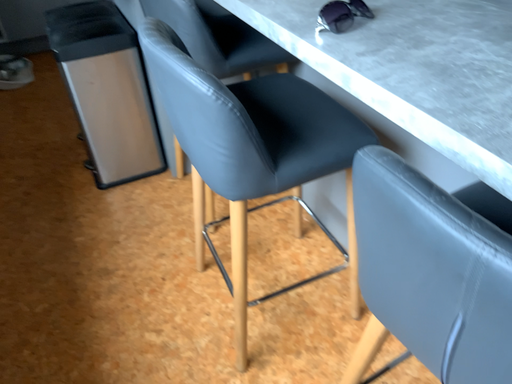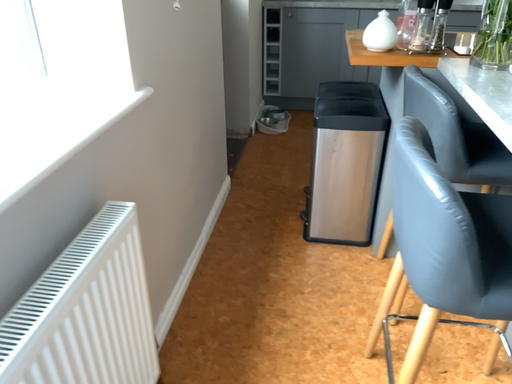
Question: How did the camera likely rotate when shooting the video?

Choices:
 (A) rotated left
 (B) rotated right

Answer: (A)